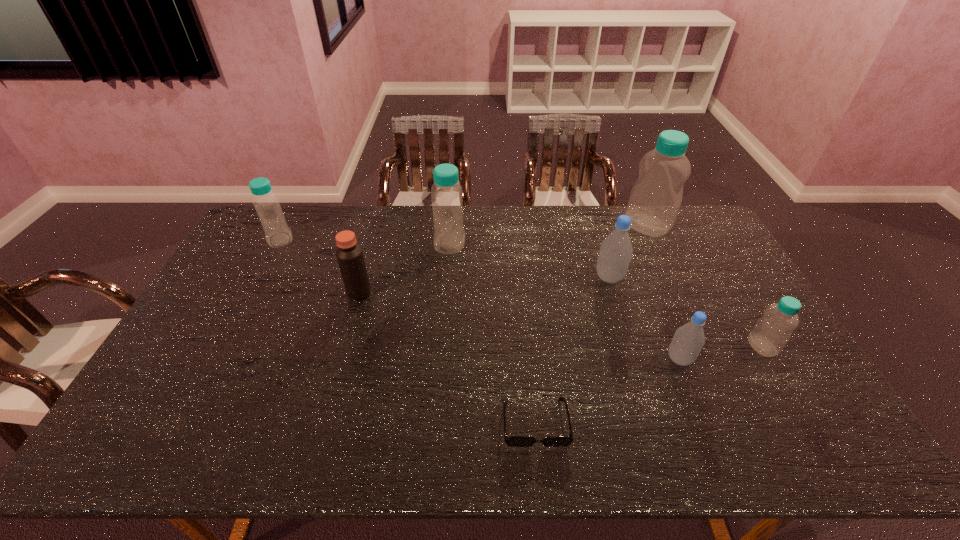
Identify the location of free space at the far left corner of the desktop. Image resolution: width=960 pixels, height=540 pixels. (254, 233).

This screenshot has width=960, height=540. What are the coordinates of `empty location between the right gray bottle and the sunglasses` in the screenshot? It's located at (608, 390).

Identify the location of empty space between the third nearest bottle and the leftmost object. The height and width of the screenshot is (540, 960). (444, 259).

The height and width of the screenshot is (540, 960). In order to click on empty location between the sunglasses and the smallest blue bottle in this screenshot , I will do `click(649, 384)`.

Locate an element on the screen. This screenshot has height=540, width=960. vacant point located between the second object from left to right and the rightmost bottle is located at coordinates (561, 319).

At what (x,y) coordinates should I click in order to perform the action: click on vacant space that is in between the rightmost blue bottle and the second bottle from left to right. Please return your answer as a coordinate pair (x, y). The image size is (960, 540). Looking at the image, I should click on tap(606, 295).

The image size is (960, 540). I want to click on unoccupied position between the smallest blue bottle and the nearer gray bottle, so click(x=721, y=353).

This screenshot has height=540, width=960. Find the location of `blank region between the nearest blue bottle and the tallest object`. blank region between the nearest blue bottle and the tallest object is located at coordinates (705, 286).

The width and height of the screenshot is (960, 540). I want to click on free space between the third blue bottle from left to right and the second biggest blue bottle, so click(x=548, y=235).

Find the location of a particular element. The width and height of the screenshot is (960, 540). vacant region between the nearer gray bottle and the farther gray bottle is located at coordinates (644, 318).